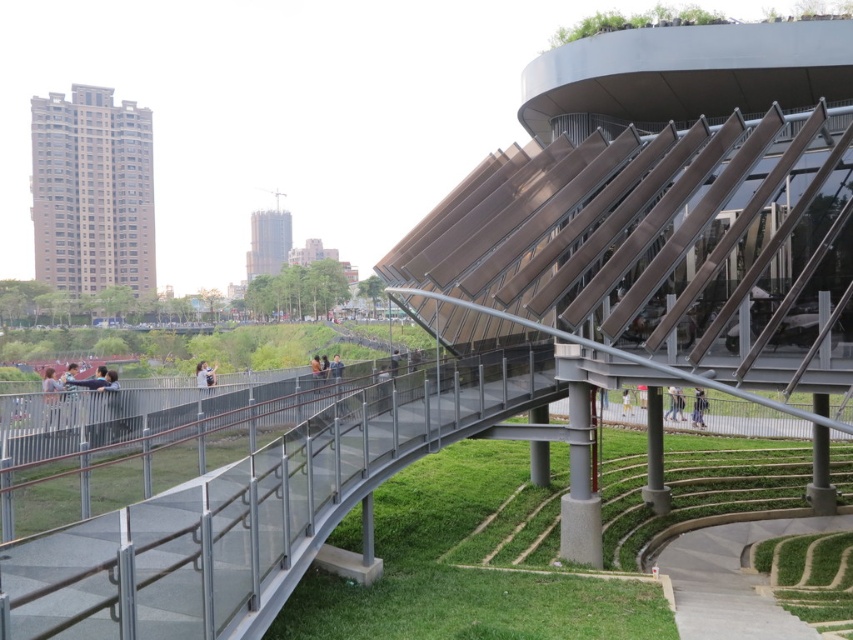
Does brown concrete building at left appear under light brown leather jacket at center?

Incorrect, brown concrete building at left is not positioned below light brown leather jacket at center.

Can you confirm if brown concrete building at left is wider than light brown leather jacket at center?

Indeed, brown concrete building at left has a greater width compared to light brown leather jacket at center.

Locate an element on the screen. Image resolution: width=853 pixels, height=640 pixels. brown concrete building at left is located at coordinates (91, 193).

The image size is (853, 640). Identify the location of brown concrete building at left. (91, 193).

Can you confirm if green grass at center is wider than light brown leather jacket at center?

Yes, green grass at center is wider than light brown leather jacket at center.

Image resolution: width=853 pixels, height=640 pixels. What do you see at coordinates (468, 563) in the screenshot? I see `green grass at center` at bounding box center [468, 563].

Find the location of a particular element. green grass at center is located at coordinates point(468,563).

Who is higher up, green grass at center or green grass at lower right?

Positioned higher is green grass at center.

Is green grass at center to the left of green grass at lower right from the viewer's perspective?

Yes, green grass at center is to the left of green grass at lower right.

Does point (357, 614) lie behind point (790, 609)?

No, (357, 614) is in front of (790, 609).

Where is `green grass at center`? Image resolution: width=853 pixels, height=640 pixels. green grass at center is located at coordinates (468, 563).